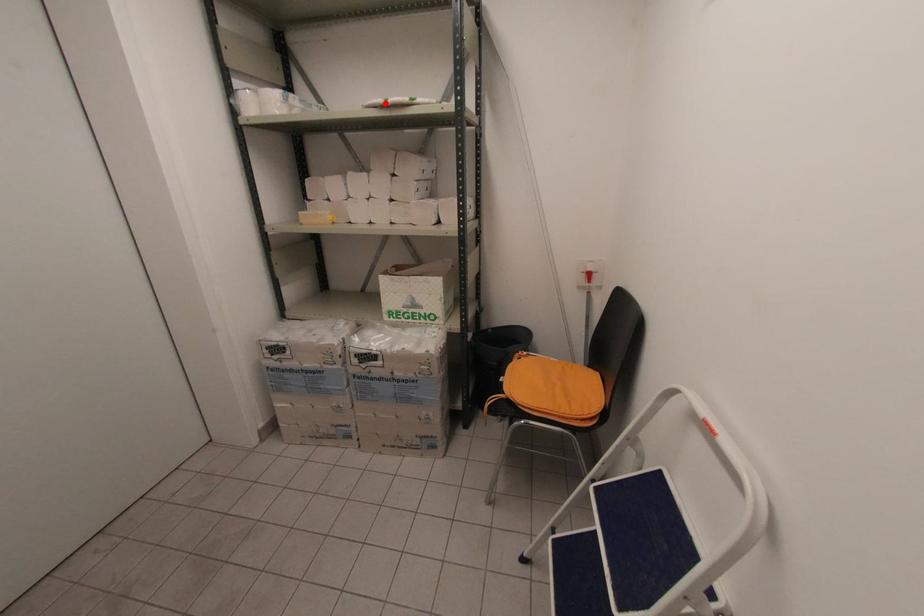
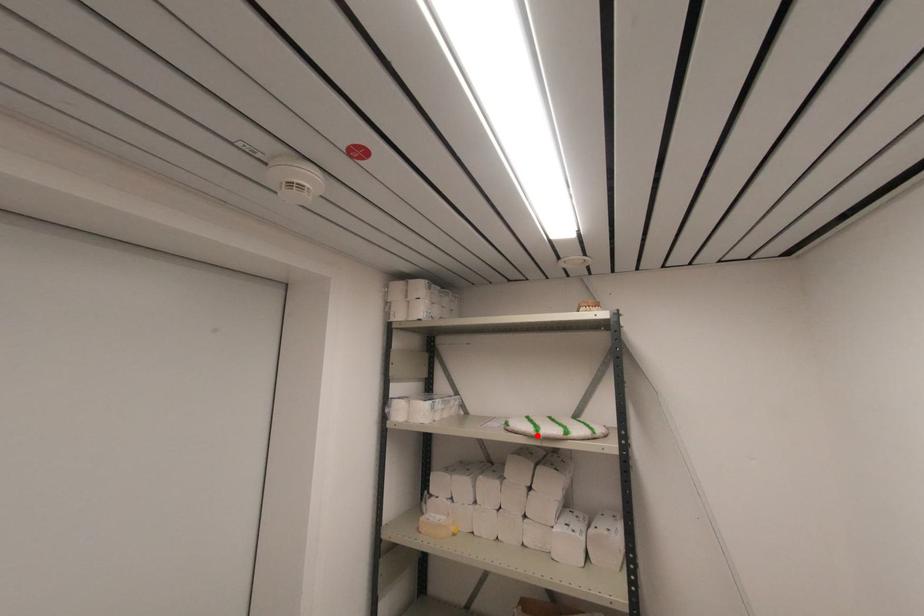
I am providing you with two images of the same scene from different viewpoints. A red point is marked on the first image and another point is marked on the second image. Do the highlighted points in image1 and image2 indicate the same real-world spot?

Yes